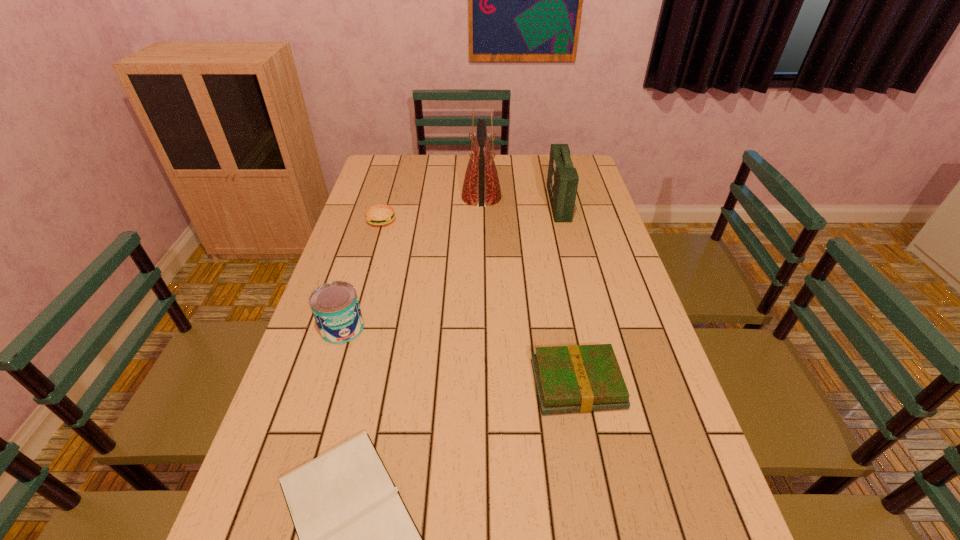
Find the location of a particular element. handbag is located at coordinates (481, 187).

Where is `the fourth object from left to right`? the fourth object from left to right is located at coordinates (481, 187).

The image size is (960, 540). I want to click on the first-aid kit, so pyautogui.click(x=562, y=180).

The width and height of the screenshot is (960, 540). In order to click on can in this screenshot , I will do `click(335, 306)`.

This screenshot has height=540, width=960. I want to click on the fourth farthest object, so click(335, 306).

This screenshot has height=540, width=960. Identify the location of book. (575, 378).

Find the location of `patty`. patty is located at coordinates (380, 214).

Identify the location of vacant space positioned on the left of the handbag. (410, 197).

Identify the location of free location located 0.310m on the front-facing side of the fifth shortest object. (465, 203).

Image resolution: width=960 pixels, height=540 pixels. Identify the location of free space located 0.400m on the front-facing side of the fifth shortest object. (441, 203).